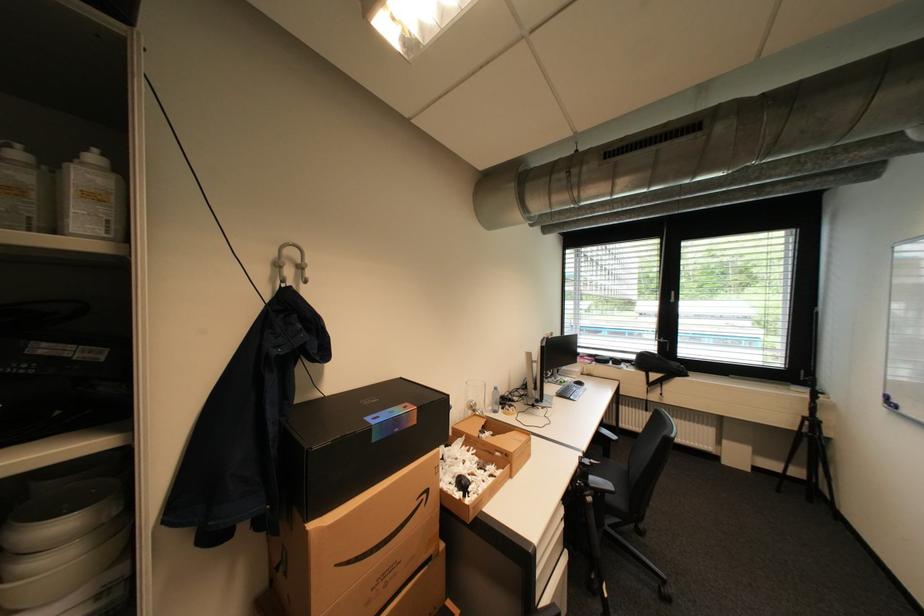
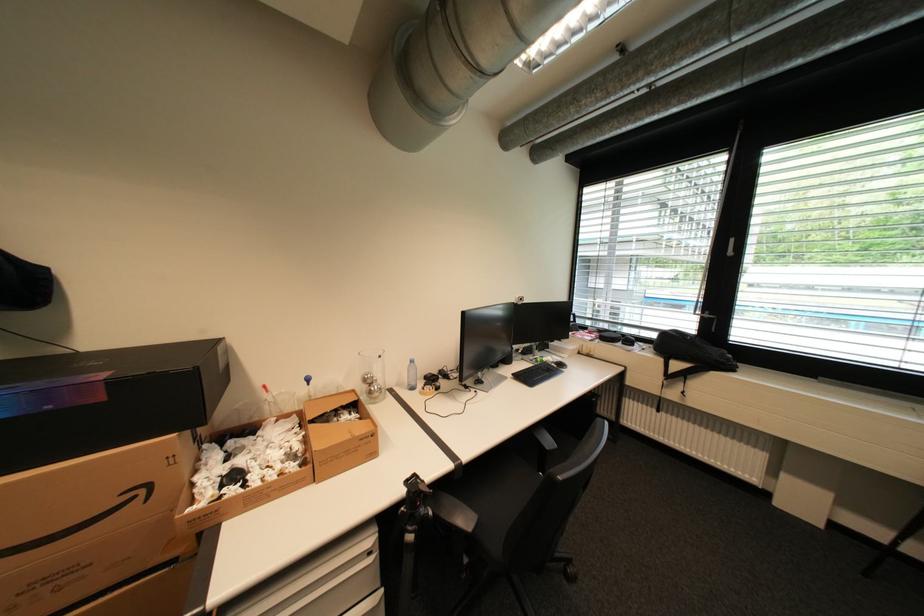
Which direction would the cameraman need to move to produce the second image?

The cameraman moved toward right, forward.